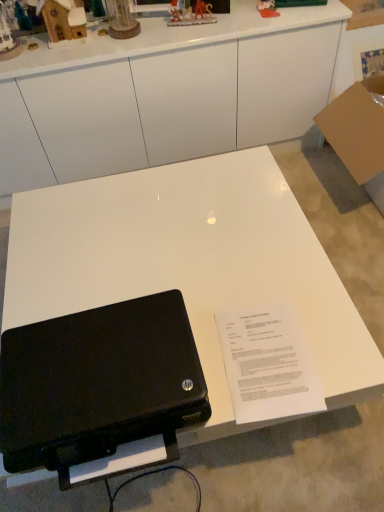
Identify the location of blank space situated above white glossy table at center (from a real-world perspective). point(145,242).